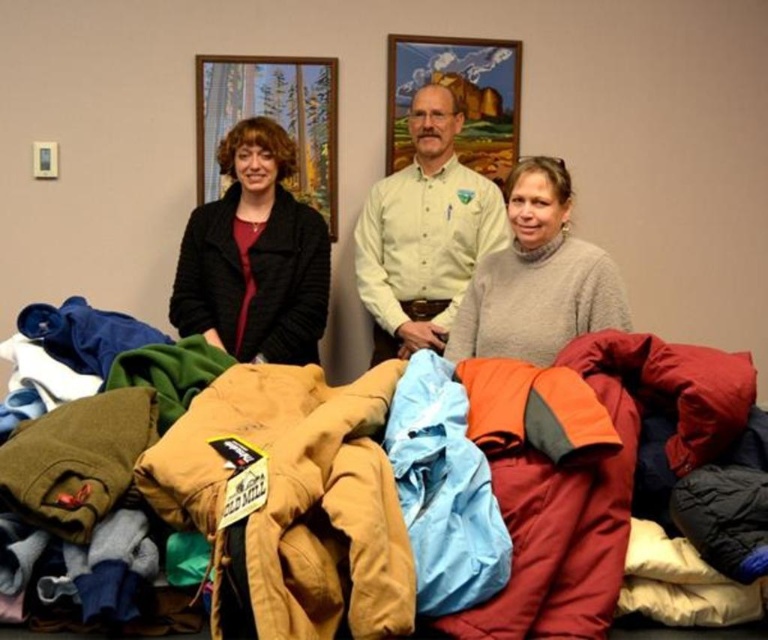
You are organizing a clothing donation drive and need to arrange items by visibility. The scene shows two items at center, a textured fleece jackets at center and a light gray wool sweater at center. Which item should you place in front to ensure both are visible?

The textured fleece jackets at center is already in front of the light gray wool sweater at center, so keeping them in this arrangement ensures both items are visible.

What does the point at coordinates [257,488] in the image represent?

The point at coordinates [257,488] corresponds to textured fleece jackets at center.

You are a delivery person who needs to place a new wooden picture frame at upper center on a shelf that is 1.5 meters wide. The shelf currently has textured fleece jackets at center. Can the frame fit on the same shelf without moving the jackets?

→ The distance between the textured fleece jackets at center and wooden picture frame at upper center is 1.85 meters. Since the shelf is only 1.5 meters wide, the frame cannot fit on the same shelf without moving the jackets.